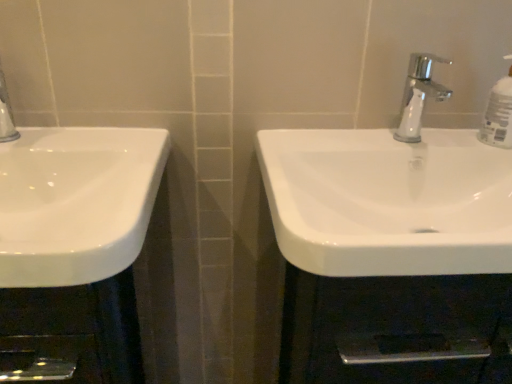
Question: In terms of size, does clear plastic bottle at upper right appear bigger or smaller than chrome metallic faucet at upper center?

Choices:
 (A) big
 (B) small

Answer: (B)

Question: Considering their positions, is clear plastic bottle at upper right located in front of or behind chrome metallic faucet at upper center?

Choices:
 (A) front
 (B) behind

Answer: (B)

Question: Estimate the real-world distances between objects in this image. Which object is farther from the clear plastic bottle at upper right?

Choices:
 (A) white glossy sink at center, which appears as the first sink when viewed from the right
 (B) white glossy sink at left, placed as the second sink when sorted from right to left
 (C) chrome metallic faucet at upper center

Answer: (B)

Question: Considering the real-world distances, which object is farthest from the chrome metallic faucet at upper center?

Choices:
 (A) white glossy sink at left, which is the first sink in left-to-right order
 (B) clear plastic bottle at upper right
 (C) white glossy sink at center, which appears as the first sink when viewed from the right

Answer: (A)